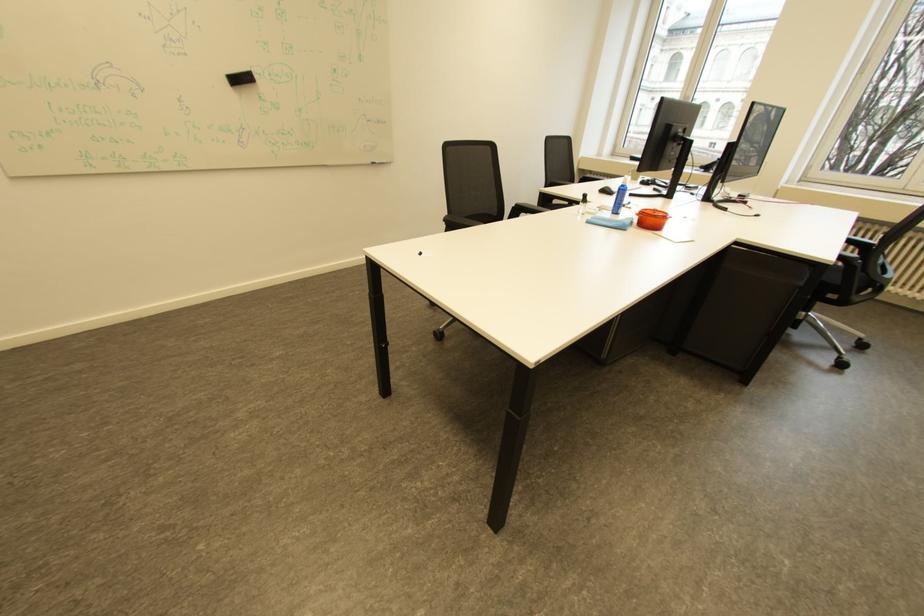
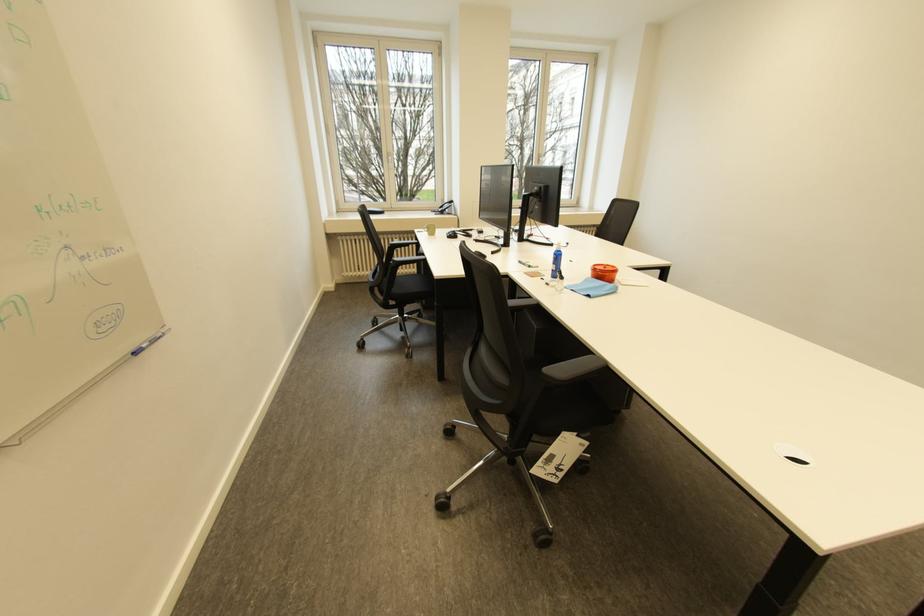
The point at (383, 161) is marked in the first image. Where is the corresponding point in the second image?

(141, 350)